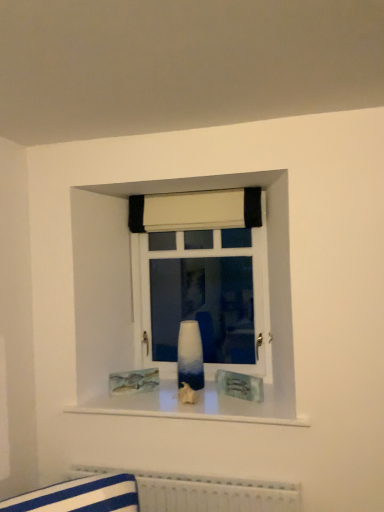
Image resolution: width=384 pixels, height=512 pixels. In order to click on white textured radiator at lower center in this screenshot , I will do `click(204, 492)`.

Identify the location of ombre glass vase at center. The width and height of the screenshot is (384, 512). (203, 276).

Is white fabric curtain at upper center far from ombre glass vase at center?

white fabric curtain at upper center is near ombre glass vase at center, not far away.

Considering the sizes of objects white fabric curtain at upper center and ombre glass vase at center in the image provided, who is wider, white fabric curtain at upper center or ombre glass vase at center?

With larger width is white fabric curtain at upper center.

Which of these two, white fabric curtain at upper center or ombre glass vase at center, stands shorter?

white fabric curtain at upper center is shorter.

Is white fabric curtain at upper center facing towards ombre glass vase at center?

No, white fabric curtain at upper center is not oriented towards ombre glass vase at center.

From a real-world perspective, between ombre glass vase at center and blue glossy vase at center, who is vertically lower?

From a 3D spatial view, blue glossy vase at center is below.

The height and width of the screenshot is (512, 384). Find the location of `window behind the blue glossy vase at center`. window behind the blue glossy vase at center is located at coordinates point(203,276).

Considering the sizes of objects ombre glass vase at center and blue glossy vase at center in the image provided, who is smaller, ombre glass vase at center or blue glossy vase at center?

blue glossy vase at center is smaller.

Consider the image. From the image's perspective, between ombre glass vase at center and blue glossy vase at center, which one is located above?

ombre glass vase at center appears higher in the image.

Which point is more distant from viewer, [197,225] or [157,482]?

The point [197,225] is farther.

Does white fabric curtain at upper center have a greater width compared to white textured radiator at lower center?

In fact, white fabric curtain at upper center might be narrower than white textured radiator at lower center.

Identify the location of radiator located underneath the white fabric curtain at upper center (from a real-world perspective). (204, 492).

Looking at this image, is blue glossy vase at center in contact with white textured radiator at lower center?

There is a gap between blue glossy vase at center and white textured radiator at lower center.

Find the location of a particular element. vase lying on the right of white textured radiator at lower center is located at coordinates (190, 356).

From the image's perspective, is blue glossy vase at center below white textured radiator at lower center?

No, from the image's perspective, blue glossy vase at center is not below white textured radiator at lower center.

Measure the distance between blue glossy vase at center and white textured radiator at lower center.

blue glossy vase at center is 60.57 centimeters away from white textured radiator at lower center.

Is blue glossy vase at center inside white textured radiator at lower center?

That's incorrect, blue glossy vase at center is not inside white textured radiator at lower center.

Find the location of a particular element. The width and height of the screenshot is (384, 512). radiator in front of the blue glossy vase at center is located at coordinates (204, 492).

Could you tell me if white textured radiator at lower center is turned towards blue glossy vase at center?

No, white textured radiator at lower center is not aimed at blue glossy vase at center.

Is white textured radiator at lower center wider or thinner than blue glossy vase at center?

Considering their sizes, white textured radiator at lower center looks broader than blue glossy vase at center.

Can you tell me how much white fabric curtain at upper center and blue glossy vase at center differ in facing direction?

The facing directions of white fabric curtain at upper center and blue glossy vase at center are 3.18 degrees apart.

Based on the photo, from a real-world perspective, which is physically below, white fabric curtain at upper center or blue glossy vase at center?

blue glossy vase at center.

Where is `vase on the left of white fabric curtain at upper center`? The height and width of the screenshot is (512, 384). vase on the left of white fabric curtain at upper center is located at coordinates 190,356.

Looking at this image, is white fabric curtain at upper center in contact with blue glossy vase at center?

No, white fabric curtain at upper center is not touching blue glossy vase at center.

You are a GUI agent. You are given a task and a screenshot of the screen. Output one action in this format:
    pyautogui.click(x=<x>, y=<y>)
    Task: Click on the vase below the white fabric curtain at upper center (from the image's perspective)
    The height and width of the screenshot is (512, 384).
    Given the screenshot: What is the action you would take?
    pyautogui.click(x=190, y=356)

Which is closer to the camera, (201, 358) or (148, 208)?

Point (201, 358) is closer to the camera than point (148, 208).

Is blue glossy vase at center inside or outside of white fabric curtain at upper center?

blue glossy vase at center cannot be found inside white fabric curtain at upper center.

Is blue glossy vase at center in front of or behind white fabric curtain at upper center in the image?

Visually, blue glossy vase at center is located in front of white fabric curtain at upper center.

Where is `curtain lying in front of the ombre glass vase at center`? curtain lying in front of the ombre glass vase at center is located at coordinates (195, 211).

The height and width of the screenshot is (512, 384). What are the coordinates of `window behind the blue glossy vase at center` in the screenshot? It's located at (203, 276).

Which object lies nearer to the anchor point white fabric curtain at upper center, ombre glass vase at center or blue glossy vase at center?

ombre glass vase at center lies closer to white fabric curtain at upper center than the other object.

When comparing their distances from white fabric curtain at upper center, does ombre glass vase at center or white textured radiator at lower center seem further?

Among the two, white textured radiator at lower center is located further to white fabric curtain at upper center.

Estimate the real-world distances between objects in this image. Which object is closer to blue glossy vase at center, white fabric curtain at upper center or white textured radiator at lower center?

Among the two, white textured radiator at lower center is located nearer to blue glossy vase at center.

Considering their positions, is ombre glass vase at center positioned closer to blue glossy vase at center than white textured radiator at lower center?

ombre glass vase at center is positioned closer to the anchor blue glossy vase at center.

Considering their positions, is white textured radiator at lower center positioned closer to blue glossy vase at center than ombre glass vase at center?

ombre glass vase at center lies closer to blue glossy vase at center than the other object.

Which object lies nearer to the anchor point ombre glass vase at center, blue glossy vase at center or white textured radiator at lower center?

Based on the image, blue glossy vase at center appears to be nearer to ombre glass vase at center.

From the image, which object appears to be farther from white fabric curtain at upper center, blue glossy vase at center or white textured radiator at lower center?

Among the two, white textured radiator at lower center is located further to white fabric curtain at upper center.

When comparing their distances from ombre glass vase at center, does white fabric curtain at upper center or blue glossy vase at center seem further?

Among the two, blue glossy vase at center is located further to ombre glass vase at center.

Identify the location of vase that lies between ombre glass vase at center and white textured radiator at lower center from top to bottom. The height and width of the screenshot is (512, 384). (190, 356).

Image resolution: width=384 pixels, height=512 pixels. Identify the location of vase that lies between white fabric curtain at upper center and white textured radiator at lower center from top to bottom. (190, 356).

The height and width of the screenshot is (512, 384). Find the location of `window between white fabric curtain at upper center and white textured radiator at lower center in the vertical direction`. window between white fabric curtain at upper center and white textured radiator at lower center in the vertical direction is located at coordinates (203, 276).

This screenshot has width=384, height=512. I want to click on window between white fabric curtain at upper center and blue glossy vase at center vertically, so click(203, 276).